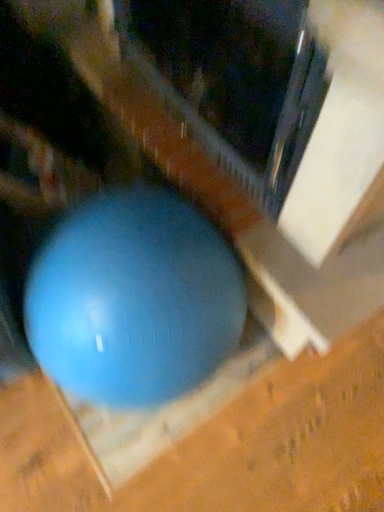
What do you see at coordinates (133, 298) in the screenshot? I see `blue rubber ball at center` at bounding box center [133, 298].

Measure the distance between blue rubber ball at center and camera.

They are 32.36 inches apart.

Find the location of `blue rubber ball at center`. blue rubber ball at center is located at coordinates (133, 298).

The width and height of the screenshot is (384, 512). In order to click on blue rubber ball at center in this screenshot , I will do `click(133, 298)`.